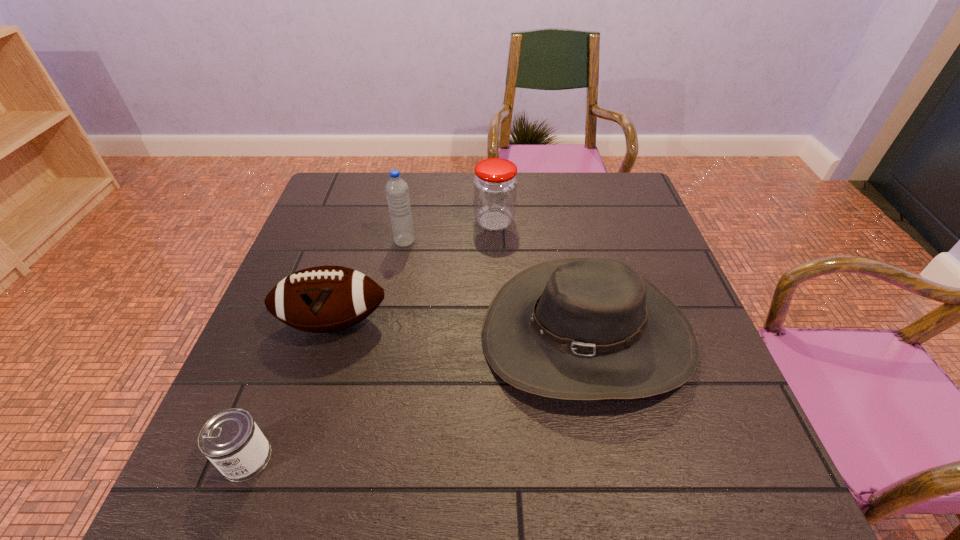
Where is `free space between the football (American) and the jar`? The height and width of the screenshot is (540, 960). free space between the football (American) and the jar is located at coordinates (414, 272).

Identify the location of empty location between the jar and the football (American). (414, 272).

At what (x,y) coordinates should I click in order to perform the action: click on object that ranks as the second closest to the jar. Please return your answer as a coordinate pair (x, y). The height and width of the screenshot is (540, 960). Looking at the image, I should click on (580, 329).

Select which object appears as the fourth closest to the football (American). Please provide its 2D coordinates. Your answer should be formatted as a tuple, i.e. [(x, y)], where the tuple contains the x and y coordinates of a point satisfying the conditions above.

[(495, 185)]

In order to click on free space that satisfies the following two spatial constraints: 1. on the back side of the water bottle; 2. on the left side of the jar in this screenshot , I will do `click(409, 221)`.

The height and width of the screenshot is (540, 960). Identify the location of vacant space that satisfies the following two spatial constraints: 1. on the back side of the shortest object; 2. on the left side of the tallest object. (330, 241).

The height and width of the screenshot is (540, 960). What are the coordinates of `free spot that satisfies the following two spatial constraints: 1. on the back side of the jar; 2. on the right side of the tallest object` in the screenshot? It's located at (409, 221).

The height and width of the screenshot is (540, 960). In order to click on vacant space that satisfies the following two spatial constraints: 1. on the back side of the nearest object; 2. on the right side of the water bottle in this screenshot , I will do `click(330, 241)`.